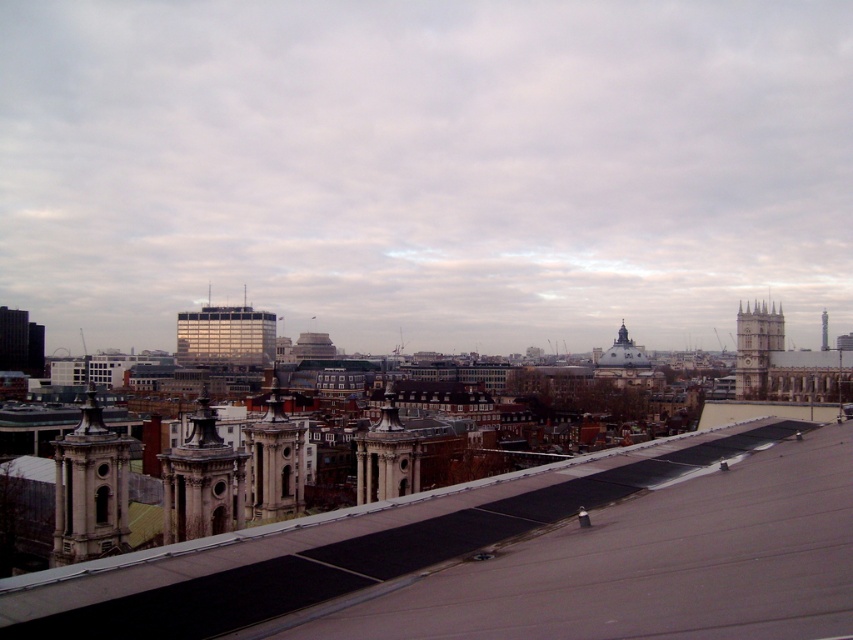
You are standing on the edge of the gray flat roof at center and looking out towards the city. There is a point marked at coordinate (521, 557). What is located at that point?

The point at coordinate (521, 557) is located on the gray flat roof at center.

You are standing on the edge of the roof in the foreground and looking out at the city. Which of the two towers, the smooth stone tower at center or the stone clock tower at right, is positioned lower in the scene?

The smooth stone tower at center is positioned lower in the scene as it is described to be below the stone clock tower at right.